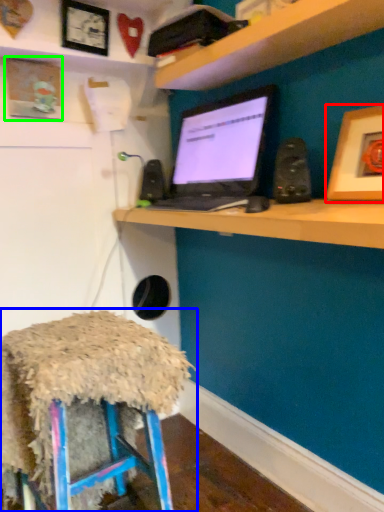
Question: Estimate the real-world distances between objects in this image. Which object is closer to picture frame (highlighted by a red box), stool (highlighted by a blue box) or picture frame (highlighted by a green box)?

Choices:
 (A) stool
 (B) picture frame

Answer: (A)